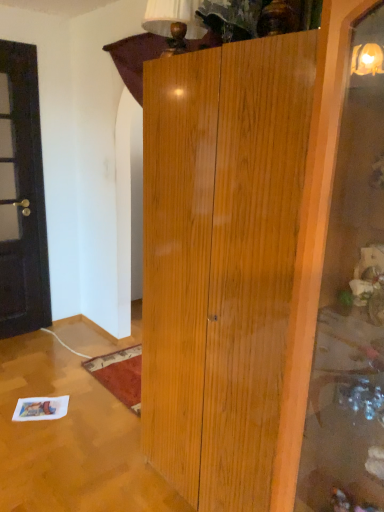
Question: Is dark brown wooden door at left inside or outside of matte brown lampshade at upper center?

Choices:
 (A) outside
 (B) inside

Answer: (A)

Question: Is point (34, 289) positioned closer to the camera than point (190, 1)?

Choices:
 (A) closer
 (B) farther

Answer: (B)

Question: Looking at their shapes, would you say dark brown wooden door at left is wider or thinner than matte brown lampshade at upper center?

Choices:
 (A) thin
 (B) wide

Answer: (A)

Question: Considering the positions of matte brown lampshade at upper center and dark brown wooden door at left in the image, is matte brown lampshade at upper center wider or thinner than dark brown wooden door at left?

Choices:
 (A) wide
 (B) thin

Answer: (A)

Question: In the image, is matte brown lampshade at upper center positioned in front of or behind dark brown wooden door at left?

Choices:
 (A) front
 (B) behind

Answer: (A)

Question: Considering the positions of matte brown lampshade at upper center and dark brown wooden door at left in the image, is matte brown lampshade at upper center bigger or smaller than dark brown wooden door at left?

Choices:
 (A) small
 (B) big

Answer: (A)

Question: From the image's perspective, is matte brown lampshade at upper center positioned above or below dark brown wooden door at left?

Choices:
 (A) below
 (B) above

Answer: (B)